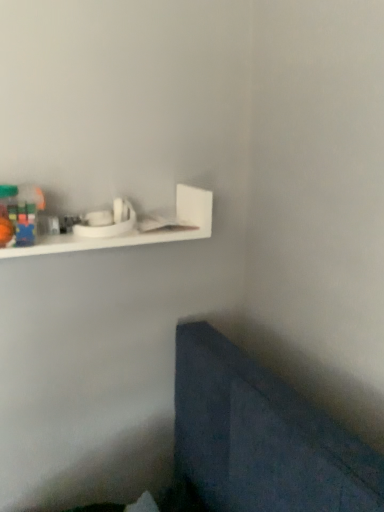
The height and width of the screenshot is (512, 384). What do you see at coordinates (19, 214) in the screenshot?
I see `rubberized plastic blocks at upper left` at bounding box center [19, 214].

Measure the distance between point (x=19, y=188) and camera.

Point (x=19, y=188) is 98.20 centimeters away from camera.

At what (x,y) coordinates should I click in order to perform the action: click on rubberized plastic blocks at upper left. Please return your answer as a coordinate pair (x, y). Looking at the image, I should click on (19, 214).

The width and height of the screenshot is (384, 512). Describe the element at coordinates (135, 229) in the screenshot. I see `white matte shelf at upper left` at that location.

Locate an element on the screen. The height and width of the screenshot is (512, 384). white matte shelf at upper left is located at coordinates (135, 229).

You are a GUI agent. You are given a task and a screenshot of the screen. Output one action in this format:
    pyautogui.click(x=<x>, y=<y>)
    Task: Click on the rubberized plastic blocks at upper left
    
    Given the screenshot: What is the action you would take?
    pyautogui.click(x=19, y=214)

Between rubberized plastic blocks at upper left and white matte shelf at upper left, which one appears on the left side from the viewer's perspective?

From the viewer's perspective, rubberized plastic blocks at upper left appears more on the left side.

Between rubberized plastic blocks at upper left and white matte shelf at upper left, which one is positioned in front?

rubberized plastic blocks at upper left is more forward.

Is point (20, 225) positioned behind point (114, 237)?

No, (20, 225) is closer to viewer.

From the image's perspective, which one is positioned higher, rubberized plastic blocks at upper left or white matte shelf at upper left?

white matte shelf at upper left appears higher in the image.

From a real-world perspective, is rubberized plastic blocks at upper left over white matte shelf at upper left?

Yes, from a real-world perspective, rubberized plastic blocks at upper left is above white matte shelf at upper left.

Which object is wider, rubberized plastic blocks at upper left or white matte shelf at upper left?

Wider between the two is white matte shelf at upper left.

Is rubberized plastic blocks at upper left taller or shorter than white matte shelf at upper left?

In the image, rubberized plastic blocks at upper left appears to be shorter than white matte shelf at upper left.

Between rubberized plastic blocks at upper left and white matte shelf at upper left, which one has larger size?

white matte shelf at upper left is bigger.

Based on the photo, do you think rubberized plastic blocks at upper left is within white matte shelf at upper left, or outside of it?

rubberized plastic blocks at upper left exists entirely within white matte shelf at upper left.

Would you consider rubberized plastic blocks at upper left to be distant from white matte shelf at upper left?

No.

Is rubberized plastic blocks at upper left looking in the opposite direction of white matte shelf at upper left?

Yes, rubberized plastic blocks at upper left is facing away from white matte shelf at upper left.

From the picture: How many degrees apart are the facing directions of rubberized plastic blocks at upper left and white matte shelf at upper left?

There is a 0.00424-degree angle between the facing directions of rubberized plastic blocks at upper left and white matte shelf at upper left.

This screenshot has height=512, width=384. Find the location of `toy lying below the white matte shelf at upper left (from the image's perspective)`. toy lying below the white matte shelf at upper left (from the image's perspective) is located at coordinates (19, 214).

In the scene shown: Does white matte shelf at upper left appear on the right side of rubberized plastic blocks at upper left?

Correct, you'll find white matte shelf at upper left to the right of rubberized plastic blocks at upper left.

Considering the relative positions of white matte shelf at upper left and rubberized plastic blocks at upper left in the image provided, is white matte shelf at upper left behind rubberized plastic blocks at upper left?

Yes, white matte shelf at upper left is behind rubberized plastic blocks at upper left.

Which is farther, (125, 245) or (1, 232)?

The point (125, 245) is farther from the camera.

From the image's perspective, does white matte shelf at upper left appear lower than rubberized plastic blocks at upper left?

No, from the image's perspective, white matte shelf at upper left is not below rubberized plastic blocks at upper left.

From a real-world perspective, who is located higher, white matte shelf at upper left or rubberized plastic blocks at upper left?

rubberized plastic blocks at upper left, from a real-world perspective.

Considering the sizes of objects white matte shelf at upper left and rubberized plastic blocks at upper left in the image provided, who is wider, white matte shelf at upper left or rubberized plastic blocks at upper left?

With larger width is white matte shelf at upper left.

Considering the sizes of white matte shelf at upper left and rubberized plastic blocks at upper left in the image, is white matte shelf at upper left taller or shorter than rubberized plastic blocks at upper left?

white matte shelf at upper left is taller than rubberized plastic blocks at upper left.

From the picture: Is white matte shelf at upper left bigger or smaller than rubberized plastic blocks at upper left?

Considering their sizes, white matte shelf at upper left takes up more space than rubberized plastic blocks at upper left.

From the picture: Is white matte shelf at upper left not within rubberized plastic blocks at upper left?

Indeed, white matte shelf at upper left is completely outside rubberized plastic blocks at upper left.

Is white matte shelf at upper left not close to rubberized plastic blocks at upper left?

white matte shelf at upper left is actually quite close to rubberized plastic blocks at upper left.

Is white matte shelf at upper left looking in the opposite direction of rubberized plastic blocks at upper left?

white matte shelf at upper left does not have its back to rubberized plastic blocks at upper left.

Identify the location of shelf located on the right of rubberized plastic blocks at upper left. The image size is (384, 512). (135, 229).

Locate an element on the screen. This screenshot has height=512, width=384. shelf below the rubberized plastic blocks at upper left (from a real-world perspective) is located at coordinates (135, 229).

Find the location of a particular element. The image size is (384, 512). shelf above the rubberized plastic blocks at upper left (from the image's perspective) is located at coordinates (135, 229).